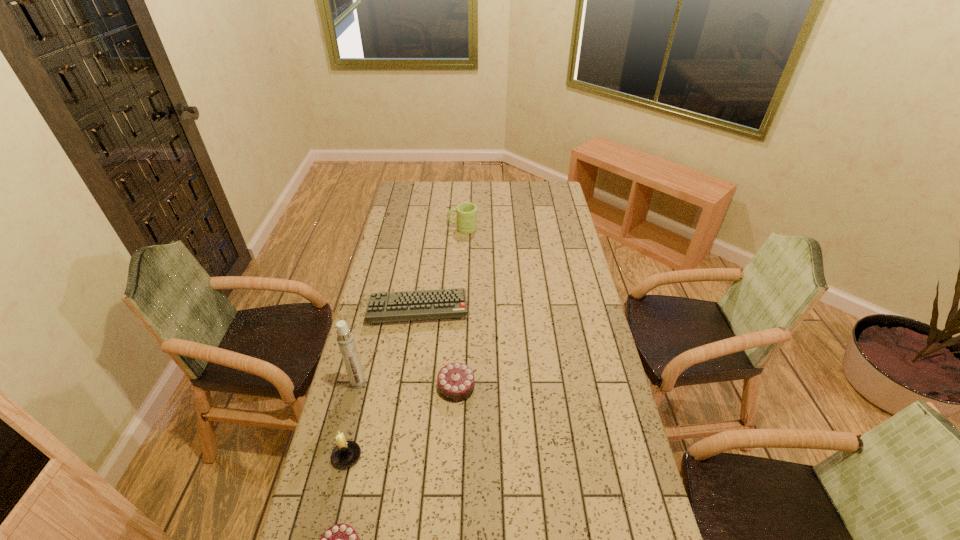
You are a GUI agent. You are given a task and a screenshot of the screen. Output one action in this format:
    pyautogui.click(x=<x>, y=<y>)
    Task: Click on the vacant space that's between the aerosol can and the second farthest object
    The image size is (960, 540).
    Given the screenshot: What is the action you would take?
    pyautogui.click(x=388, y=346)

This screenshot has width=960, height=540. Find the location of `free spot between the second nearest object and the farthest object`. free spot between the second nearest object and the farthest object is located at coordinates (404, 342).

You are a GUI agent. You are given a task and a screenshot of the screen. Output one action in this format:
    pyautogui.click(x=<x>, y=<y>)
    Task: Click on the free point between the fifth nearest object and the mug
    This screenshot has height=540, width=960.
    Given the screenshot: What is the action you would take?
    pyautogui.click(x=441, y=268)

Identify the location of vacant space that is in between the second nearest object and the farther chocolate cake. The width and height of the screenshot is (960, 540). (401, 422).

Find the location of a particular element. unoccupied position between the tallest object and the computer keyboard is located at coordinates (388, 346).

Identify which object is the fourth nearest to the candle holder. Please provide its 2D coordinates. Your answer should be formatted as a tuple, i.e. [(x, y)], where the tuple contains the x and y coordinates of a point satisfying the conditions above.

[(441, 303)]

You are a GUI agent. You are given a task and a screenshot of the screen. Output one action in this format:
    pyautogui.click(x=<x>, y=<y>)
    Task: Click on the object that is the second closest to the left chocolate cake
    The image size is (960, 540).
    Given the screenshot: What is the action you would take?
    pyautogui.click(x=455, y=381)

Find the location of a particular element. free space that satisfies the following two spatial constraints: 1. on the front side of the tallest object; 2. on the left side of the candle holder is located at coordinates (340, 456).

Where is `vacant space that satisfies the following two spatial constraints: 1. on the back side of the candle holder; 2. on the right side of the farther chocolate cake`? vacant space that satisfies the following two spatial constraints: 1. on the back side of the candle holder; 2. on the right side of the farther chocolate cake is located at coordinates (363, 387).

In order to click on vacant area that satisfies the following two spatial constraints: 1. on the side of the mug with the handle; 2. on the front side of the tallest object in this screenshot , I will do pos(454,383).